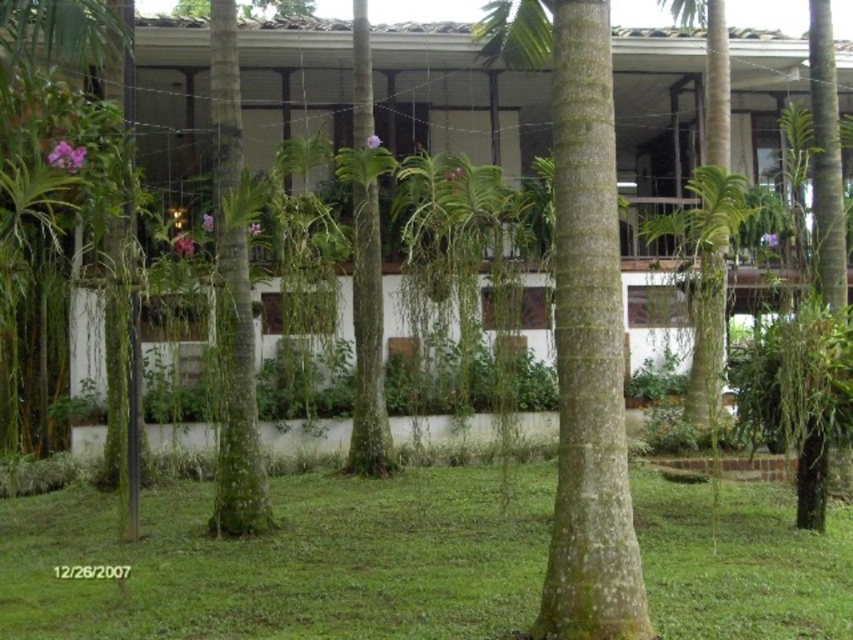
Question: Which point is farther to the camera?

Choices:
 (A) (352, 132)
 (B) (590, 310)
 (C) (460, 561)

Answer: (A)

Question: Which of the following is the farthest from the observer?

Choices:
 (A) green leafy tree at center
 (B) green grass at center
 (C) green textured tree at center

Answer: (A)

Question: Can you confirm if green grass at center is positioned below green leafy tree at center?

Choices:
 (A) no
 (B) yes

Answer: (B)

Question: Does green textured tree at center appear on the right side of green leafy tree at center?

Choices:
 (A) no
 (B) yes

Answer: (B)

Question: Is green textured tree at center positioned before green leafy tree at center?

Choices:
 (A) no
 (B) yes

Answer: (B)

Question: Which of these objects is positioned farthest from the green textured tree at center?

Choices:
 (A) green grass at center
 (B) green leafy tree at center

Answer: (B)